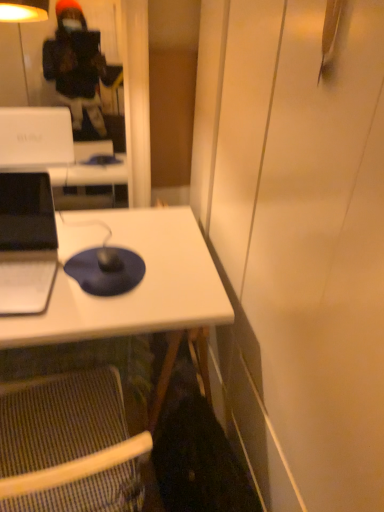
Question: From a real-world perspective, is blue matte mousepad at center physically below matte black laptop at left?

Choices:
 (A) no
 (B) yes

Answer: (B)

Question: Is blue matte mousepad at center positioned with its back to matte black laptop at left?

Choices:
 (A) no
 (B) yes

Answer: (A)

Question: Is blue matte mousepad at center shorter than matte black laptop at left?

Choices:
 (A) yes
 (B) no

Answer: (A)

Question: Is blue matte mousepad at center smaller than matte black laptop at left?

Choices:
 (A) yes
 (B) no

Answer: (A)

Question: Are blue matte mousepad at center and matte black laptop at left making contact?

Choices:
 (A) no
 (B) yes

Answer: (A)

Question: From the image's perspective, is blue matte mousepad at center located beneath matte black laptop at left?

Choices:
 (A) no
 (B) yes

Answer: (B)

Question: Is matte black laptop at left touching white matte desk at center?

Choices:
 (A) yes
 (B) no

Answer: (B)

Question: From the image's perspective, does matte black laptop at left appear higher than white matte desk at center?

Choices:
 (A) no
 (B) yes

Answer: (B)

Question: Does matte black laptop at left have a lesser width compared to white matte desk at center?

Choices:
 (A) yes
 (B) no

Answer: (A)

Question: Considering the relative positions of matte black laptop at left and white matte desk at center in the image provided, is matte black laptop at left to the left of white matte desk at center from the viewer's perspective?

Choices:
 (A) yes
 (B) no

Answer: (A)

Question: Is white matte desk at center at the back of matte black laptop at left?

Choices:
 (A) no
 (B) yes

Answer: (A)

Question: Is matte black laptop at left oriented towards white matte desk at center?

Choices:
 (A) yes
 (B) no

Answer: (B)

Question: Is striped fabric folding chair at lower left touching matte black laptop at left?

Choices:
 (A) yes
 (B) no

Answer: (B)